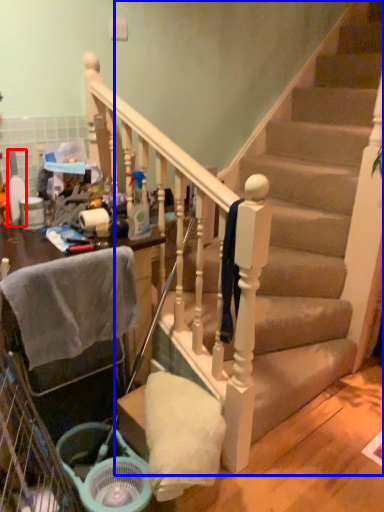
Question: Which object appears closest to the camera in this image, bottle (highlighted by a red box) or stairs (highlighted by a blue box)?

Choices:
 (A) bottle
 (B) stairs

Answer: (B)